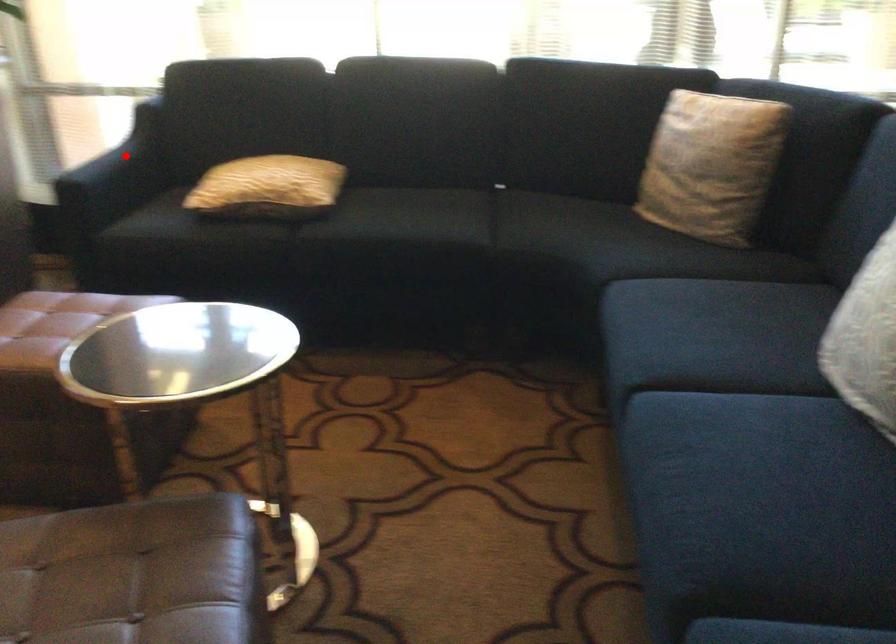
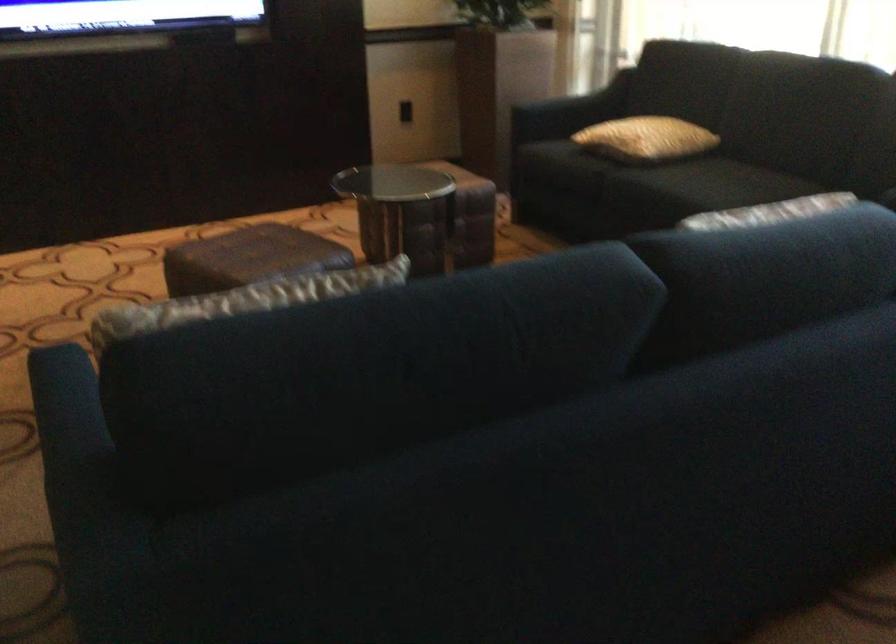
Question: I am providing you with two images of the same scene from different viewpoints. Image1 has a red point marked. In image2, the corresponding 3D location appears at what relative position? Reply with the corresponding letter.

Choices:
 (A) Closer
 (B) Farther

Answer: (B)